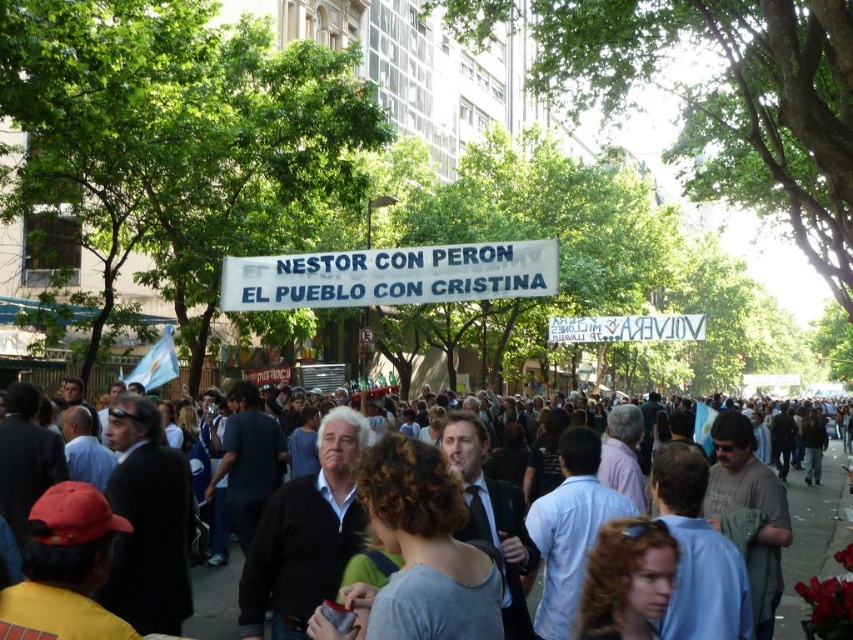
You are a photographer standing at the edge of the crowd. You want to take a photo that includes both the white paper banner at center and the gray cotton shirt at center. Given their distance apart, can you fit both into your camera frame which has a maximum field of view of 25 meters?

The white paper banner at center and gray cotton shirt at center are 25.41 meters apart from each other. Since the camera frame can only capture up to 25 meters, the distance between them exceeds the maximum field of view by 0.41 meters. Therefore, both objects cannot be fully captured in a single frame.

You are a photographer trying to capture a photo of the gray cotton shirt at center and the white paper banner at center. You want to ensure that both are fully visible in the frame. Which object should you focus on to ensure both are in the shot?

The white paper banner at center is narrower than the gray cotton shirt at center, so focusing on the gray cotton shirt at center will ensure both objects are fully visible in the frame since it is wider.

You are a photographer standing in the crowd and want to take a photo of both the white paper banner at center and the gray cotton shirt at center. Which object is closer to you?

The white paper banner at center is closer to you than the gray cotton shirt at center.